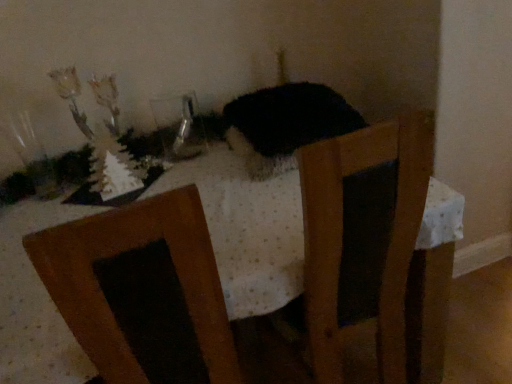
The image size is (512, 384). I want to click on free space in front of fuzzy black cat at center, so (274, 215).